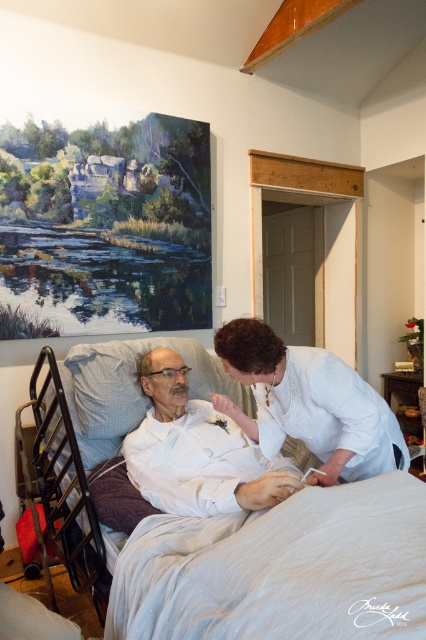
Question: Is white satin blouse at center smaller than white matte shirt at center?

Choices:
 (A) no
 (B) yes

Answer: (B)

Question: Can you confirm if white satin blouse at center is thinner than white matte shirt at center?

Choices:
 (A) no
 (B) yes

Answer: (A)

Question: Is white fabric bed at center to the left of white matte shirt at center from the viewer's perspective?

Choices:
 (A) yes
 (B) no

Answer: (B)

Question: Which point appears farthest from the camera in this image?

Choices:
 (A) (204, 508)
 (B) (371, 404)
 (C) (359, 522)

Answer: (B)

Question: Which object is the closest to the white matte shirt at center?

Choices:
 (A) white fabric bed at center
 (B) white satin blouse at center

Answer: (A)

Question: Which of these objects is positioned closest to the white matte shirt at center?

Choices:
 (A) white fabric bed at center
 (B) white satin blouse at center

Answer: (A)